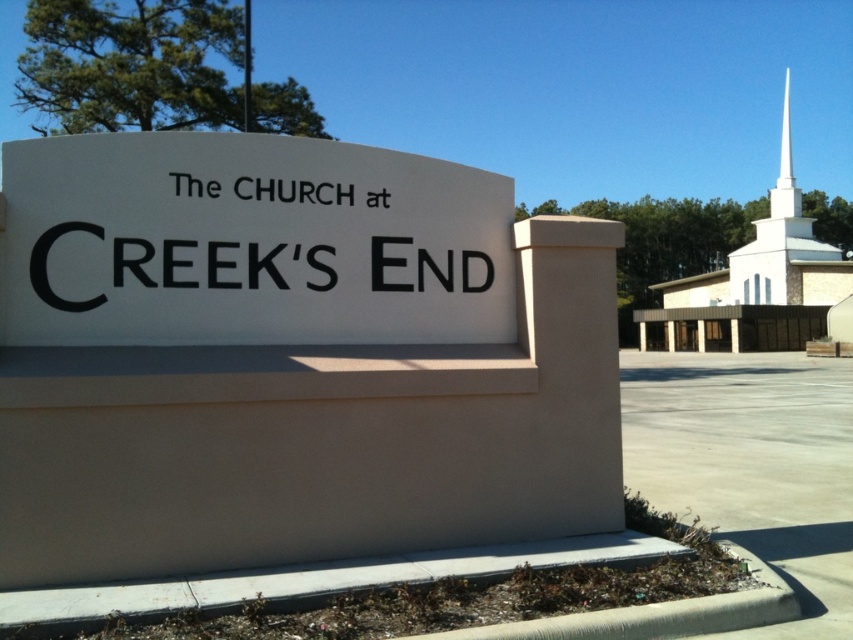
Between white smooth steeple at upper right and white smooth spire at upper right, which one has less height?

With less height is white smooth spire at upper right.

Consider the image. Does white smooth steeple at upper right come in front of white smooth spire at upper right?

That is True.

Identify the location of white smooth steeple at upper right. This screenshot has height=640, width=853. (756, 282).

Looking at this image, is white matte sign at center closer to camera compared to white smooth steeple at upper right?

Yes, white matte sign at center is in front of white smooth steeple at upper right.

Does white matte sign at center come behind white smooth steeple at upper right?

No, it is in front of white smooth steeple at upper right.

Which is in front, point (49, 177) or point (799, 200)?

Point (49, 177) is more forward.

Locate an element on the screen. white matte sign at center is located at coordinates (250, 243).

Can you confirm if white matte sign at center is taller than white smooth spire at upper right?

Incorrect, white matte sign at center's height is not larger of white smooth spire at upper right's.

Does white matte sign at center have a lesser width compared to white smooth spire at upper right?

Yes.

What do you see at coordinates (250, 243) in the screenshot?
I see `white matte sign at center` at bounding box center [250, 243].

Where is `white matte sign at center`? Image resolution: width=853 pixels, height=640 pixels. white matte sign at center is located at coordinates (250, 243).